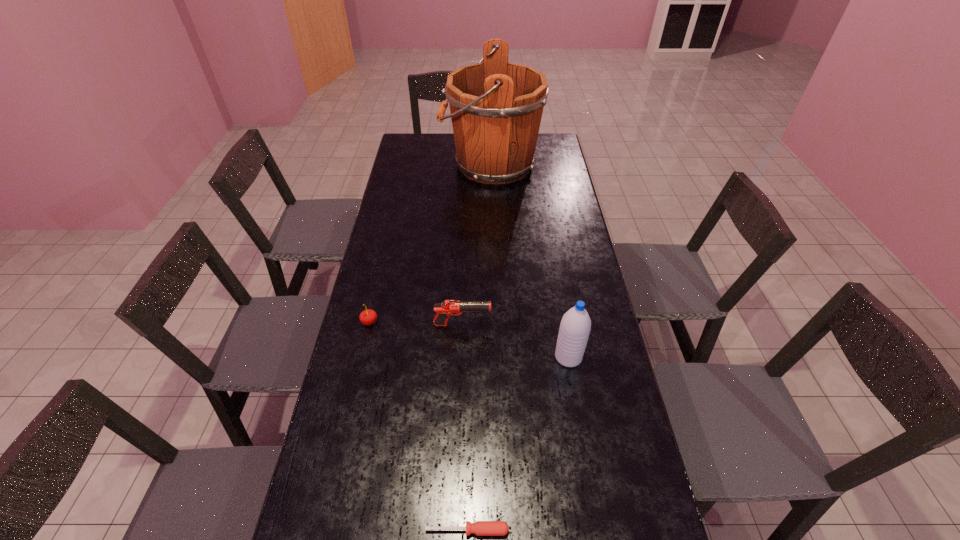
Find the location of `the tallest object`. the tallest object is located at coordinates (496, 107).

The height and width of the screenshot is (540, 960). In order to click on bucket in this screenshot , I will do `click(496, 107)`.

The width and height of the screenshot is (960, 540). What are the coordinates of `water bottle` in the screenshot? It's located at (575, 326).

Find the location of a particular element. The image size is (960, 540). the second nearest object is located at coordinates (575, 326).

The height and width of the screenshot is (540, 960). Identify the location of gun. (448, 307).

You are a GUI agent. You are given a task and a screenshot of the screen. Output one action in this format:
    pyautogui.click(x=<x>, y=<y>)
    Task: Click on the fourth tallest object
    
    Given the screenshot: What is the action you would take?
    pyautogui.click(x=367, y=317)

In order to click on the leftmost object in this screenshot , I will do `click(367, 317)`.

Where is `the shortest object`? The height and width of the screenshot is (540, 960). the shortest object is located at coordinates (481, 528).

Find the location of a particular element. Image resolution: width=960 pixels, height=540 pixels. the nearest object is located at coordinates (481, 528).

I want to click on free space located 0.110m with the handle on the side of the tallest object, so click(416, 165).